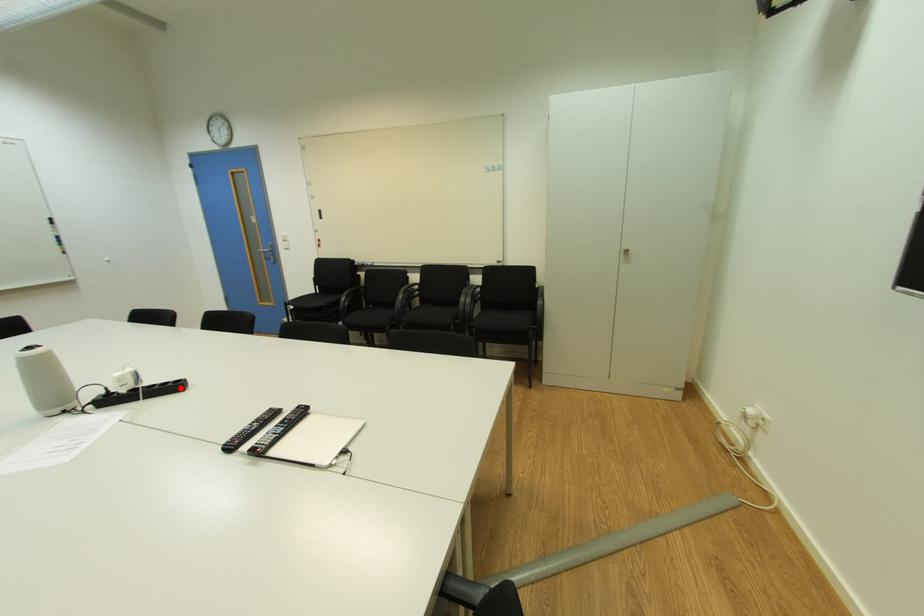
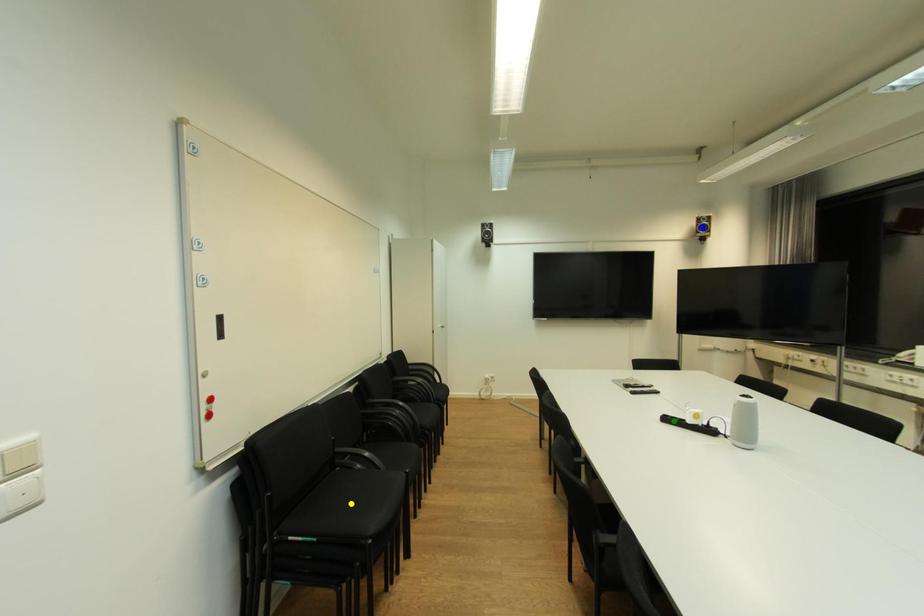
Question: I am providing you with two images of the same scene from different viewpoints. A red point is marked on the first image. You are given multiple points on the second image. Can you choose the point in image 2 that corresponds to the point in image 1?

Choices:
 (A) green point
 (B) yellow point
 (C) blue point

Answer: (A)